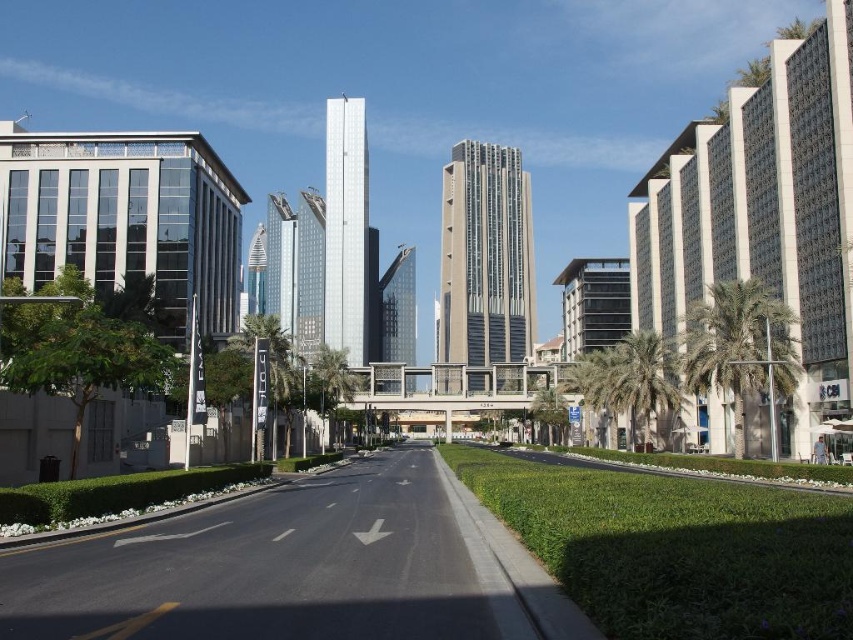
Question: Is green leafy palm tree at center-right bigger than green leafy palm tree at center?

Choices:
 (A) no
 (B) yes

Answer: (A)

Question: Is green leafy palm tree at right to the right of green leafy palm tree at center from the viewer's perspective?

Choices:
 (A) no
 (B) yes

Answer: (B)

Question: Which object is farther from the camera taking this photo?

Choices:
 (A) green leafy palm tree at left
 (B) green leafy palm tree at center

Answer: (B)

Question: Does green leafy palm tree at right lie in front of green leafy palm tree at center-right?

Choices:
 (A) yes
 (B) no

Answer: (A)

Question: Which object is farther from the camera taking this photo?

Choices:
 (A) green leafy palm tree at center
 (B) green leafy palm tree at right
 (C) green leafy palm tree at left
 (D) green leafy palm tree at center-right

Answer: (A)

Question: Among these points, which one is nearest to the camera?

Choices:
 (A) (260, 422)
 (B) (643, 433)
 (C) (747, 365)
 (D) (346, 362)

Answer: (A)